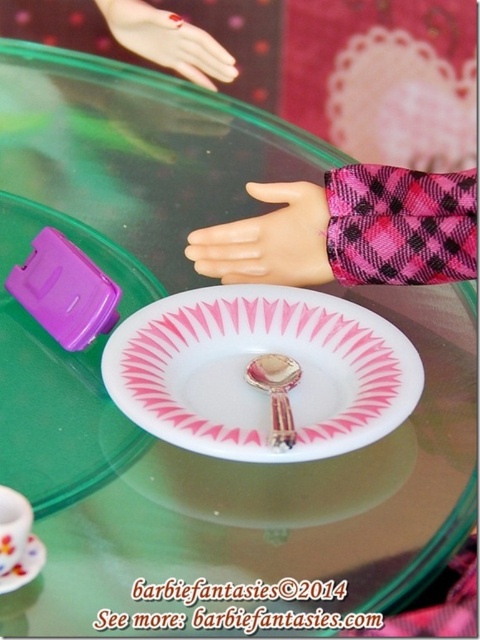
You are a toy designer observing the miniature scene. The pink matte hand at center is part of a dollhouse set. To ensure the hand can reach the spoon on the plate, where exactly should the hand be positioned? Please provide coordinates based on the image grid system where the bottom left corner is the origin point.

The pink matte hand at center should be positioned at coordinates point (268, 241) to reach the spoon on the plate.

What object is located at the coordinates point (248, 364) in the image?

The point (248, 364) corresponds to the white glossy paper plate at center.

You are a child playing with a dollhouse scene. You see the white glossy paper plate at center and the pink matte hand at upper center. Which object is positioned lower in the scene?

The white glossy paper plate at center is positioned lower than the pink matte hand at upper center.